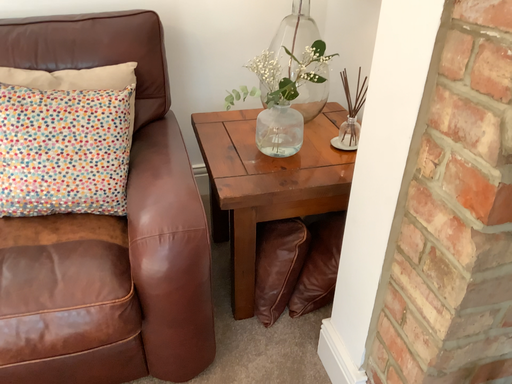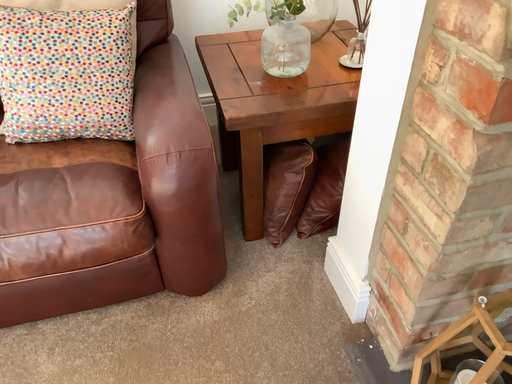
Question: Which way did the camera rotate in the video?

Choices:
 (A) rotated downward
 (B) rotated upward

Answer: (A)